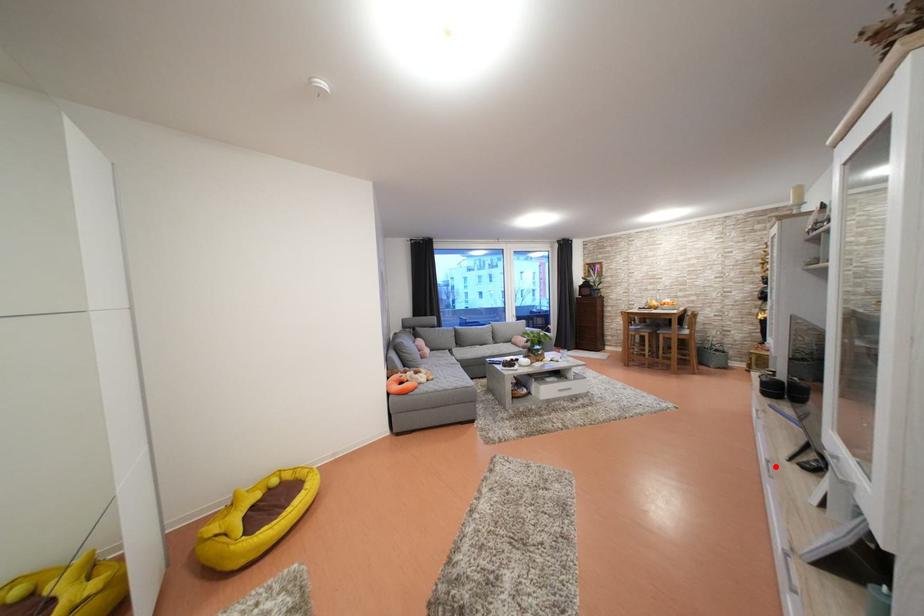
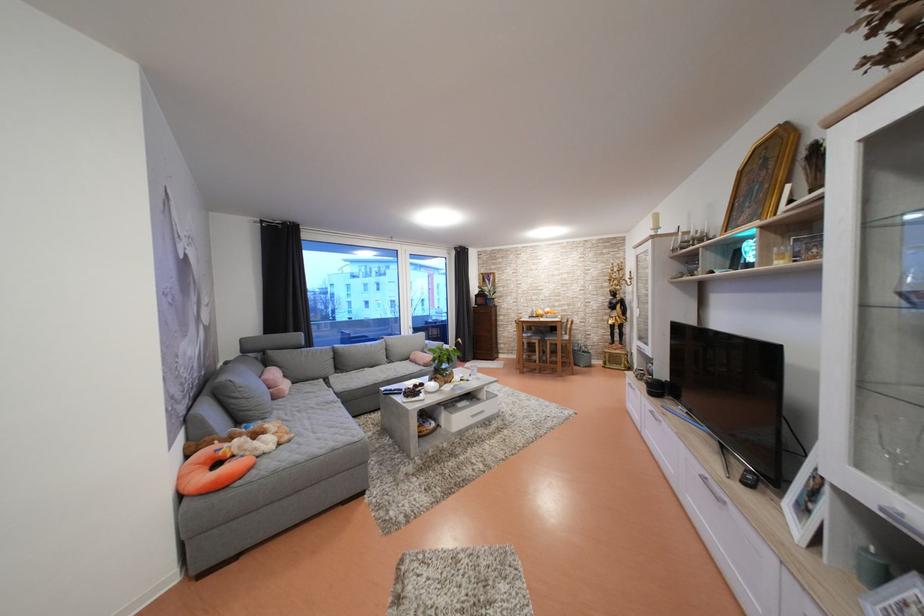
Where in the second image is the point corresponding to the highlighted location from the first image?

(711, 484)